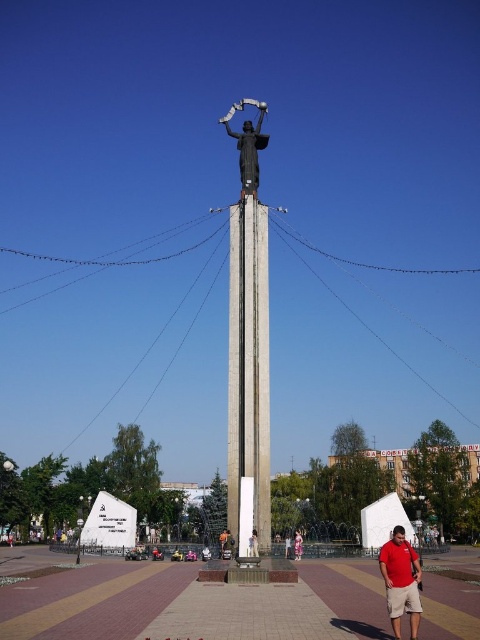
You are a photographer standing in the public square. You want to take a photo of the concrete column at center and the orange fabric bag at center. Which object should you focus on first if you want to capture both in a single frame without moving the camera?

The orange fabric bag at center is located below the concrete column at center. To capture both in a single frame without moving the camera, you should focus on the orange fabric bag at center first since it is lower and closer to the bottom of the frame, allowing the concrete column at center to naturally fall into the upper part of the composition.

You are an artist planning to sketch the monument. You notice the polished bronze statue at center and the pink fabric dress at center. Which object should you focus on first if you want to draw the wider one?

The polished bronze statue at center is wider than the pink fabric dress at center, so you should focus on the polished bronze statue at center first.